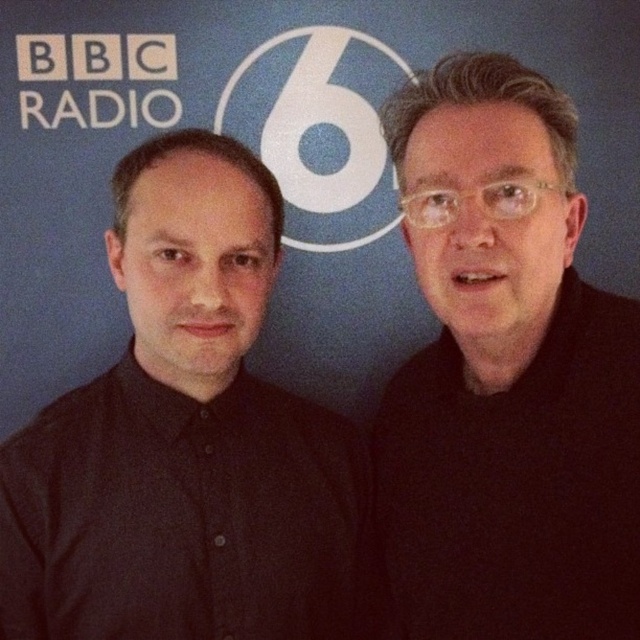
Is point (499, 170) positioned after point (84, 508)?

That is False.

This screenshot has height=640, width=640. Describe the element at coordinates (506, 376) in the screenshot. I see `black matte shirt at right` at that location.

Does point (445, 417) come farther from viewer compared to point (360, 579)?

No, it is in front of (360, 579).

At what (x,y) coordinates should I click in order to perform the action: click on black matte shirt at right. Please return your answer as a coordinate pair (x, y). The height and width of the screenshot is (640, 640). Looking at the image, I should click on (506, 376).